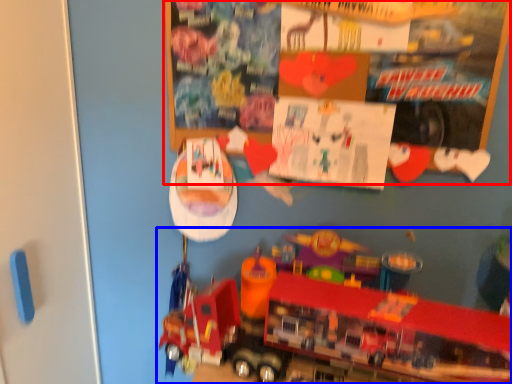
Question: Which object appears farthest to the camera in this image, bulletin board (highlighted by a red box) or toy (highlighted by a blue box)?

Choices:
 (A) bulletin board
 (B) toy

Answer: (A)